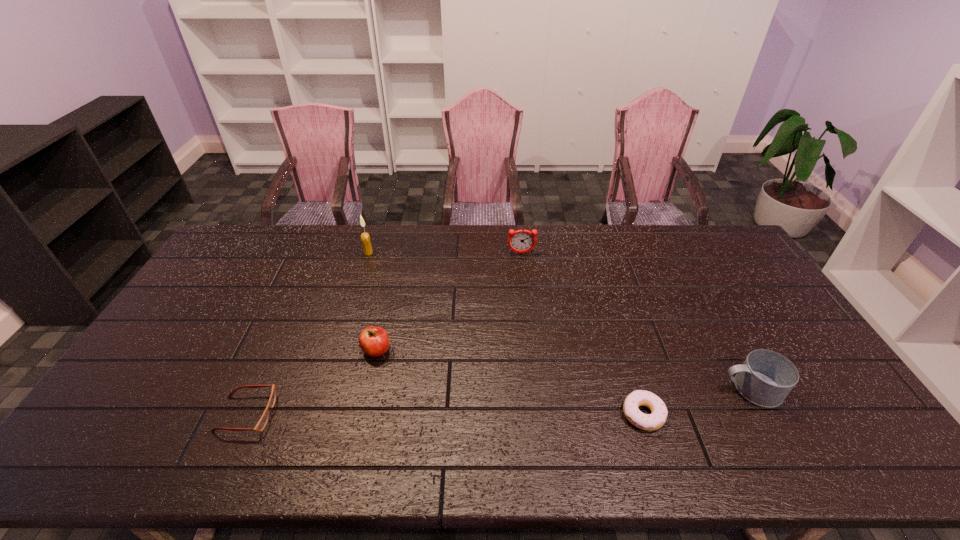
The height and width of the screenshot is (540, 960). I want to click on object at the right edge, so click(766, 377).

The image size is (960, 540). In the image, there is a desktop. Find the location of `vacant space at the far edge`. vacant space at the far edge is located at coordinates (641, 246).

Locate an element on the screen. The width and height of the screenshot is (960, 540). free space at the near edge of the desktop is located at coordinates (465, 436).

You are a GUI agent. You are given a task and a screenshot of the screen. Output one action in this format:
    pyautogui.click(x=<x>, y=<y>)
    Task: Click on the vacant space at the far left corner of the desktop
    
    Given the screenshot: What is the action you would take?
    pyautogui.click(x=260, y=246)

In the image, there is a desktop. Where is `vacant space at the near left corner`? The image size is (960, 540). vacant space at the near left corner is located at coordinates (71, 467).

This screenshot has height=540, width=960. What are the coordinates of `free area in between the second object from left to right and the second object from right to left` in the screenshot? It's located at (506, 333).

Locate an element on the screen. vacant point located between the second object from right to left and the leftmost object is located at coordinates (444, 414).

The width and height of the screenshot is (960, 540). What are the coordinates of `free space between the leftmost object and the candle` in the screenshot? It's located at (307, 333).

Find the location of a particular element. The height and width of the screenshot is (540, 960). empty location between the fifth object from right to left and the rightmost object is located at coordinates (560, 321).

You are a GUI agent. You are given a task and a screenshot of the screen. Output one action in this format:
    pyautogui.click(x=<x>, y=<y>)
    Task: Click on the unoccupied position between the third farthest object and the spectacles
    This screenshot has height=540, width=960.
    Given the screenshot: What is the action you would take?
    pyautogui.click(x=311, y=382)